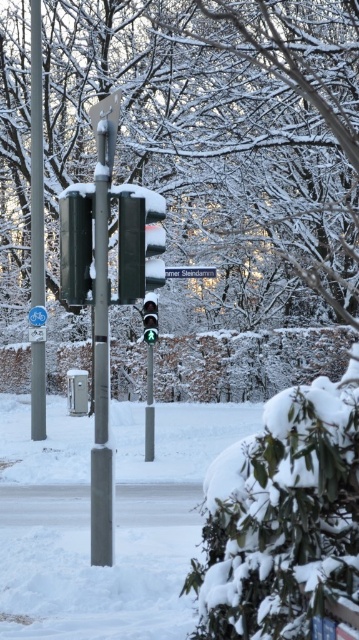
From the picture: Does metallic gray pole at center have a lesser height compared to smooth metallic pole at left?

Yes, metallic gray pole at center is shorter than smooth metallic pole at left.

Looking at this image, who is positioned more to the right, metallic gray pole at center or smooth metallic pole at left?

metallic gray pole at center

Image resolution: width=359 pixels, height=640 pixels. What do you see at coordinates (101, 362) in the screenshot?
I see `metallic gray pole at center` at bounding box center [101, 362].

The height and width of the screenshot is (640, 359). What are the coordinates of `metallic gray pole at center` in the screenshot? It's located at (101, 362).

Consider the image. Does green matte traffic light at center lie behind white plastic street sign at center?

No, green matte traffic light at center is in front of white plastic street sign at center.

Does green matte traffic light at center appear on the left side of white plastic street sign at center?

Indeed, green matte traffic light at center is positioned on the left side of white plastic street sign at center.

Identify the location of green matte traffic light at center. This screenshot has height=640, width=359. (140, 243).

Find the location of a particular element. green matte traffic light at center is located at coordinates (140, 243).

Does metallic gray pole at center appear on the left side of green glass traffic light at center?

In fact, metallic gray pole at center is to the right of green glass traffic light at center.

Does metallic gray pole at center have a greater width compared to green glass traffic light at center?

No, metallic gray pole at center is not wider than green glass traffic light at center.

This screenshot has width=359, height=640. I want to click on metallic gray pole at center, so click(101, 362).